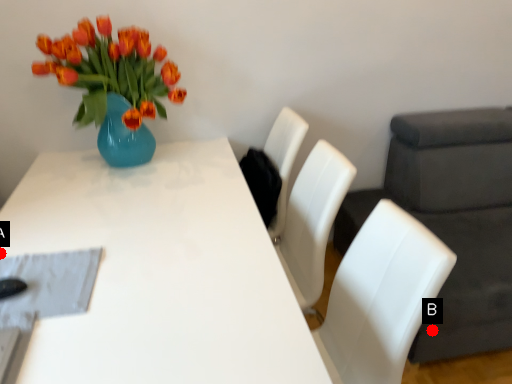
Question: Two points are circled on the image, labeled by A and B beside each circle. Which point is farther from the camera taking this photo?

Choices:
 (A) A is further
 (B) B is further

Answer: (B)